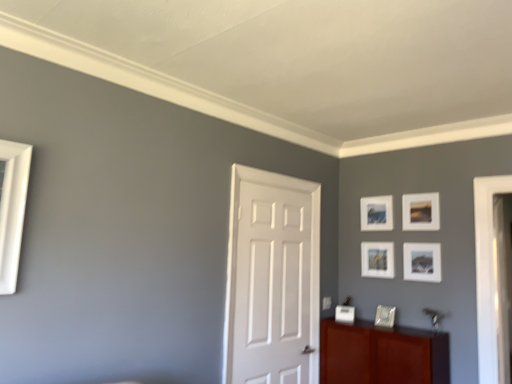
Question: From a real-world perspective, is matte white picture frame at upper right, positioned as the first picture frame in top-to-bottom order, located beneath mahogany wood cabinet at lower right?

Choices:
 (A) yes
 (B) no

Answer: (B)

Question: From the image's perspective, is matte white picture frame at upper right, placed as the fifth picture frame when sorted from bottom to top, under mahogany wood cabinet at lower right?

Choices:
 (A) no
 (B) yes

Answer: (A)

Question: Considering the relative sizes of matte white picture frame at upper right, placed as the fifth picture frame when sorted from bottom to top, and mahogany wood cabinet at lower right in the image provided, is matte white picture frame at upper right, placed as the fifth picture frame when sorted from bottom to top, bigger than mahogany wood cabinet at lower right?

Choices:
 (A) yes
 (B) no

Answer: (B)

Question: Is matte white picture frame at upper right, placed as the fifth picture frame when sorted from bottom to top, smaller than mahogany wood cabinet at lower right?

Choices:
 (A) no
 (B) yes

Answer: (B)

Question: From the image's perspective, is matte white picture frame at upper right, placed as the fifth picture frame when sorted from bottom to top, located above mahogany wood cabinet at lower right?

Choices:
 (A) yes
 (B) no

Answer: (A)

Question: Considering the relative sizes of matte white picture frame at upper right, positioned as the first picture frame in top-to-bottom order, and mahogany wood cabinet at lower right in the image provided, is matte white picture frame at upper right, positioned as the first picture frame in top-to-bottom order, wider than mahogany wood cabinet at lower right?

Choices:
 (A) no
 (B) yes

Answer: (A)

Question: Is matte white picture frame at lower center, the first picture frame ordered from the bottom, inside matte white picture frame at center, which ranks as the 2th picture frame in bottom-to-top order?

Choices:
 (A) yes
 (B) no

Answer: (B)

Question: Would you say matte white picture frame at center, which ranks as the 2th picture frame in bottom-to-top order, is a long distance from matte white picture frame at lower center, which is counted as the 5th picture frame, starting from the top?

Choices:
 (A) yes
 (B) no

Answer: (B)

Question: From the image's perspective, does matte white picture frame at center, which is counted as the fourth picture frame, starting from the top, appear higher than matte white picture frame at lower center, which is counted as the 5th picture frame, starting from the top?

Choices:
 (A) yes
 (B) no

Answer: (A)

Question: From a real-world perspective, is matte white picture frame at center, which ranks as the 2th picture frame in bottom-to-top order, on top of matte white picture frame at lower center, the first picture frame ordered from the bottom?

Choices:
 (A) yes
 (B) no

Answer: (A)

Question: Does matte white picture frame at center, which ranks as the 2th picture frame in bottom-to-top order, have a smaller size compared to matte white picture frame at lower center, which is counted as the 5th picture frame, starting from the top?

Choices:
 (A) yes
 (B) no

Answer: (B)

Question: Does matte white picture frame at center, which is counted as the fourth picture frame, starting from the top, have a greater height compared to matte white picture frame at lower center, the first picture frame ordered from the bottom?

Choices:
 (A) yes
 (B) no

Answer: (A)

Question: Is mahogany wood cabinet at lower right bigger than matte white picture frame at upper right, placed as the fifth picture frame when sorted from bottom to top?

Choices:
 (A) no
 (B) yes

Answer: (B)